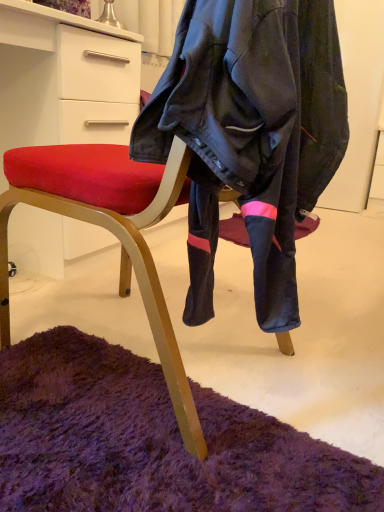
The height and width of the screenshot is (512, 384). What do you see at coordinates (64, 80) in the screenshot?
I see `white glossy desk at upper left` at bounding box center [64, 80].

This screenshot has width=384, height=512. Identify the location of white glossy desk at upper left. (64, 80).

Measure the distance between point (116,127) and camera.

The depth of point (116,127) is 1.42 meters.

Where is `white glossy desk at upper left`? white glossy desk at upper left is located at coordinates (64, 80).